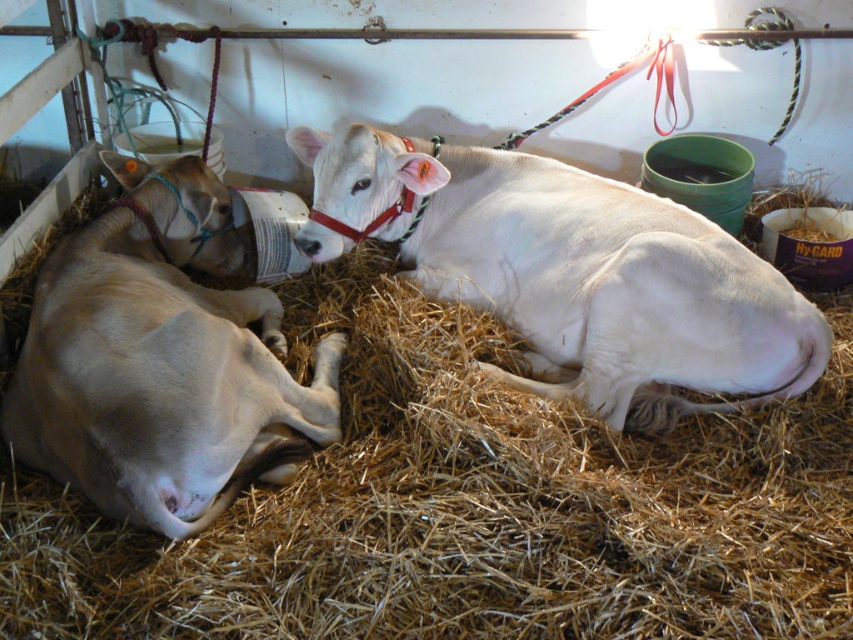
Is white smooth cow at center bigger than light brown smooth cow at left?

Yes.

Does white smooth cow at center have a lesser height compared to light brown smooth cow at left?

Yes.

Between point (370, 161) and point (195, 285), which one is positioned behind?

Positioned behind is point (370, 161).

The height and width of the screenshot is (640, 853). What are the coordinates of `white smooth cow at center` in the screenshot? It's located at (572, 273).

Who is taller, brown straw at center or white smooth cow at center?

With more height is brown straw at center.

Can you confirm if brown straw at center is positioned above white smooth cow at center?

Incorrect, brown straw at center is not positioned above white smooth cow at center.

Identify the location of brown straw at center. (467, 508).

Who is shorter, brown straw at center or light brown smooth cow at left?

Standing shorter between the two is light brown smooth cow at left.

Does point (352, 499) come in front of point (155, 244)?

Yes, it is.

Find the location of a particular element. This screenshot has height=640, width=853. brown straw at center is located at coordinates (467, 508).